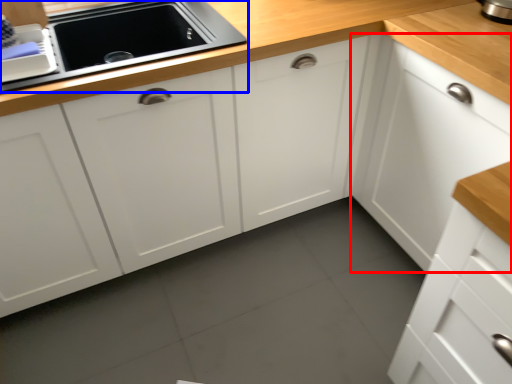
Question: Which object is closer to the camera taking this photo, cabinetry (highlighted by a red box) or home appliance (highlighted by a blue box)?

Choices:
 (A) cabinetry
 (B) home appliance

Answer: (A)